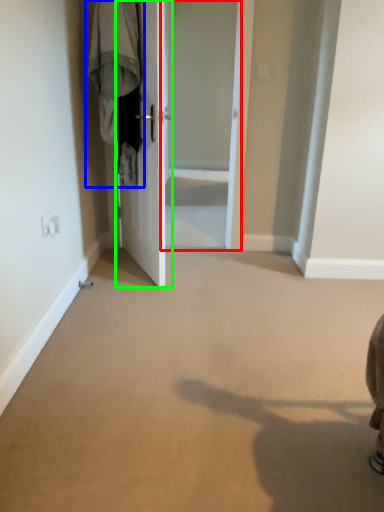
Question: Considering the real-world distances, which object is farthest from screen door (highlighted by a red box)? laundry (highlighted by a blue box) or door (highlighted by a green box)?

Choices:
 (A) laundry
 (B) door

Answer: (A)